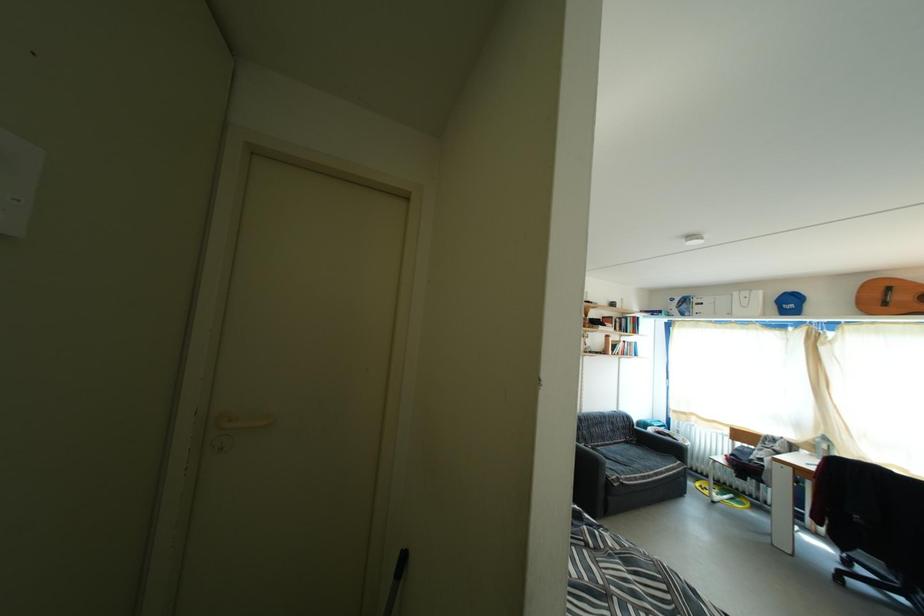
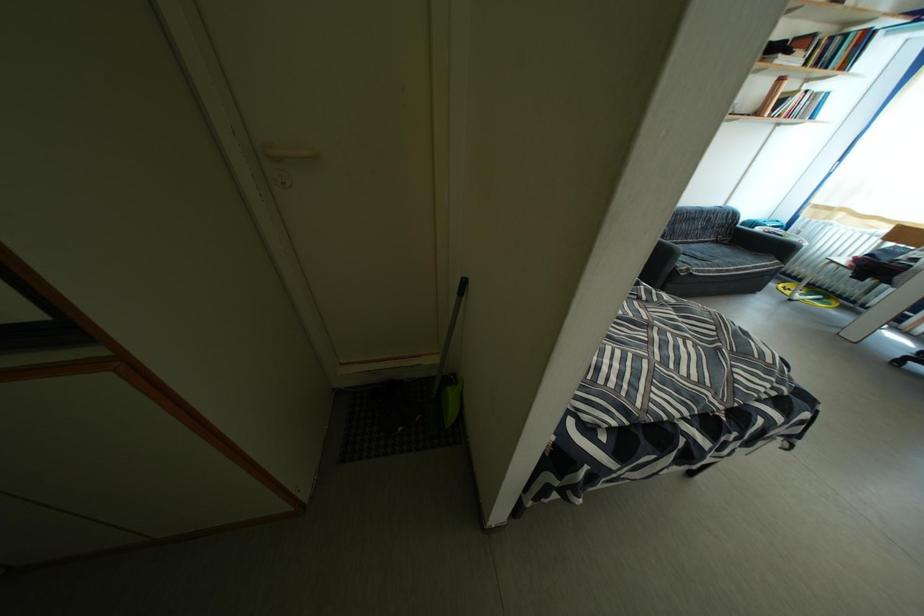
Based on the continuous images, in which direction is the camera rotating?

The camera's rotation is toward left-down.